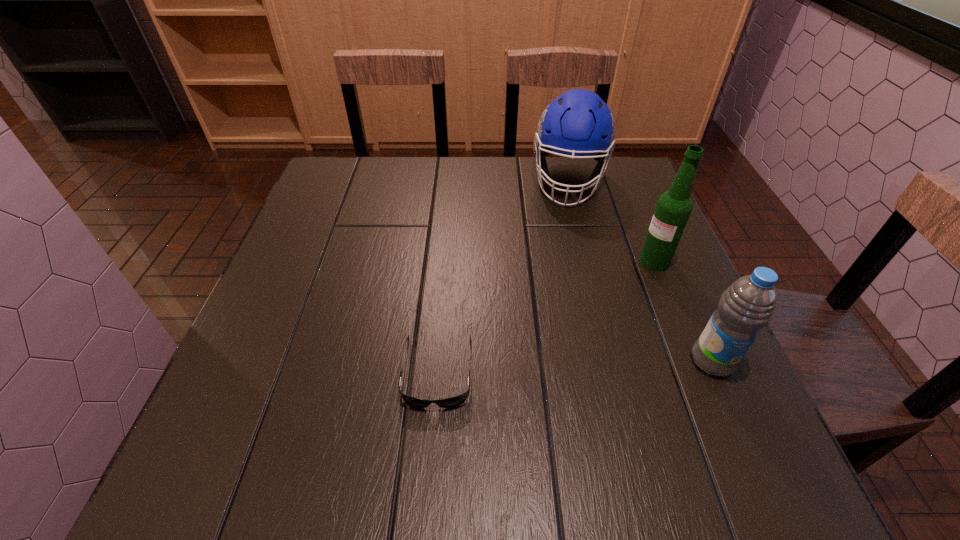
What are the coordinates of `free space that is in between the water bottle and the third nearest object` in the screenshot? It's located at (684, 311).

Locate an element on the screen. The image size is (960, 540). vacant area that lies between the beer bottle and the leftmost object is located at coordinates [x=545, y=316].

Locate an element on the screen. The height and width of the screenshot is (540, 960). vacant space in between the third object from right to left and the water bottle is located at coordinates (640, 271).

You are a GUI agent. You are given a task and a screenshot of the screen. Output one action in this format:
    pyautogui.click(x=<x>, y=<y>)
    Task: Click on the free point between the football helmet and the water bottle
    This screenshot has width=960, height=540.
    Given the screenshot: What is the action you would take?
    pyautogui.click(x=640, y=271)

Where is `free spot between the sunglasses and the beer bottle`? The image size is (960, 540). free spot between the sunglasses and the beer bottle is located at coordinates (545, 316).

You are a GUI agent. You are given a task and a screenshot of the screen. Output one action in this format:
    pyautogui.click(x=<x>, y=<y>)
    Task: Click on the vacant point located between the leftmost object and the water bottle
    
    Given the screenshot: What is the action you would take?
    pyautogui.click(x=575, y=366)

Locate which object is the closest to the farthest object. Please provide its 2D coordinates. Your answer should be formatted as a tuple, i.e. [(x, y)], where the tuple contains the x and y coordinates of a point satisfying the conditions above.

[(673, 208)]

At what (x,y) coordinates should I click in order to perform the action: click on object that is the third closest to the water bottle. Please return your answer as a coordinate pair (x, y). This screenshot has width=960, height=540. Looking at the image, I should click on (579, 123).